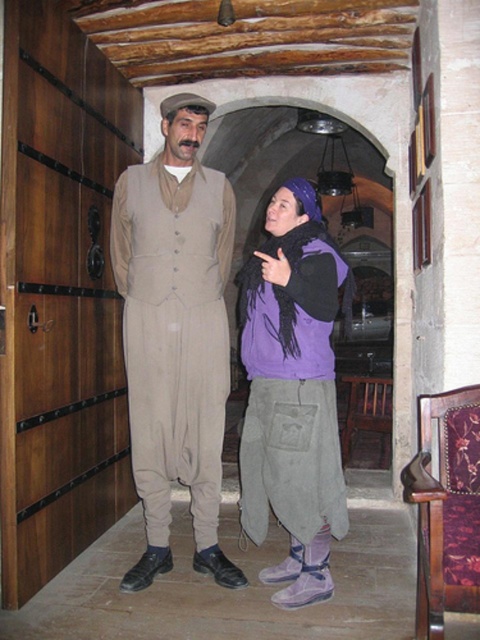
Question: Which of the following is the closest to the observer?

Choices:
 (A) (205, 545)
 (B) (294, 477)

Answer: (B)

Question: Which point appears closest to the camera in this image?

Choices:
 (A) (186, 236)
 (B) (255, 412)

Answer: (B)

Question: Is beige fabric suit at center to the left of purple fleece vest at center from the viewer's perspective?

Choices:
 (A) yes
 (B) no

Answer: (A)

Question: Which point is farther to the camera?

Choices:
 (A) (266, 440)
 (B) (156, 557)

Answer: (B)

Question: Is beige fabric suit at center to the right of purple fleece vest at center from the viewer's perspective?

Choices:
 (A) no
 (B) yes

Answer: (A)

Question: Does beige fabric suit at center appear on the right side of purple fleece vest at center?

Choices:
 (A) no
 (B) yes

Answer: (A)